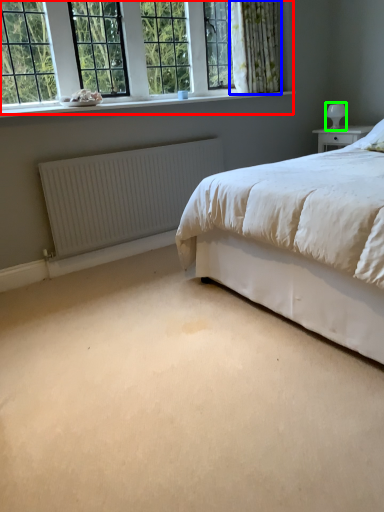
Question: Which is farther away from window (highlighted by a red box)? curtain (highlighted by a blue box) or table lamp (highlighted by a green box)?

Choices:
 (A) curtain
 (B) table lamp

Answer: (B)